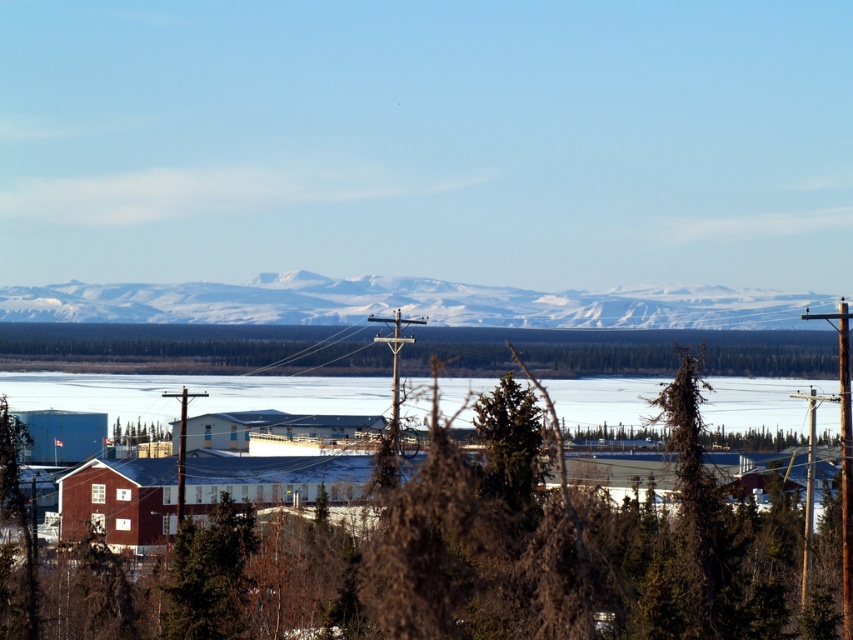
Which is above, white snow-covered mountain range at upper center or green matte tree at center?

white snow-covered mountain range at upper center is above.

Is white snow-covered mountain range at upper center to the left of green matte tree at center from the viewer's perspective?

Correct, you'll find white snow-covered mountain range at upper center to the left of green matte tree at center.

Describe the element at coordinates (405, 304) in the screenshot. I see `white snow-covered mountain range at upper center` at that location.

Image resolution: width=853 pixels, height=640 pixels. Identify the location of white snow-covered mountain range at upper center. (405, 304).

Based on the photo, does brown textured tree at center appear on the left side of white snow-covered mountain range at upper center?

Incorrect, brown textured tree at center is not on the left side of white snow-covered mountain range at upper center.

Who is taller, brown textured tree at center or white snow-covered mountain range at upper center?

brown textured tree at center

Who is more distant from viewer, [490,481] or [0,307]?

The point [0,307] is more distant.

At what (x,y) coordinates should I click in order to perform the action: click on brown textured tree at center. Please return your answer as a coordinate pair (x, y). Image resolution: width=853 pixels, height=640 pixels. Looking at the image, I should click on (511, 548).

Is brown textured tree at center to the right of green matte tree at center from the viewer's perspective?

In fact, brown textured tree at center is to the left of green matte tree at center.

Which is in front, point (410, 496) or point (541, 476)?

Point (410, 496)

Identify the location of brown textured tree at center. (511, 548).